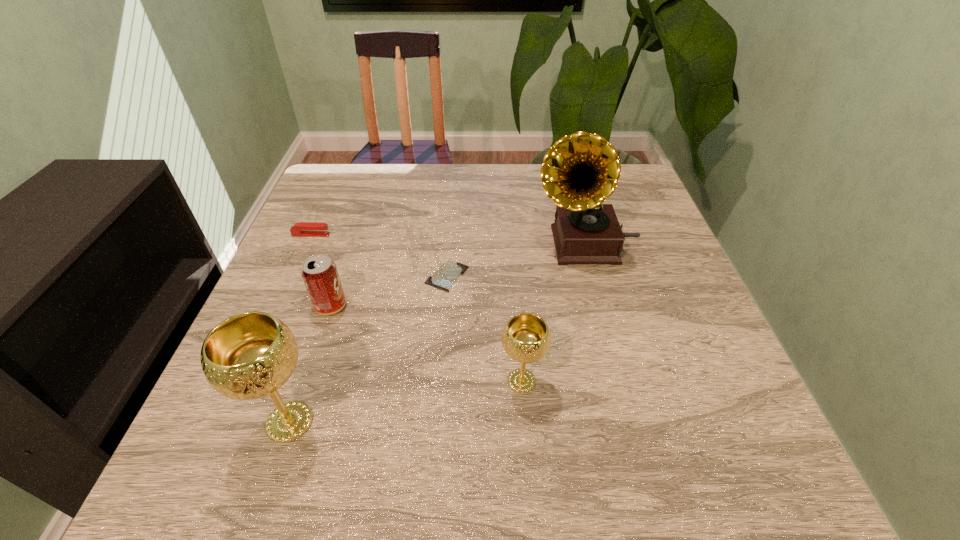
Identify the location of free spot between the shortest object and the fifth object from left to right. (484, 329).

Where is `vacant region between the right chalice and the second shortest object`? This screenshot has height=540, width=960. vacant region between the right chalice and the second shortest object is located at coordinates (417, 308).

At what (x,y) coordinates should I click in order to perform the action: click on vacant space that's between the identity card and the stapler. Please return your answer as a coordinate pair (x, y). This screenshot has width=960, height=540. Looking at the image, I should click on (379, 255).

This screenshot has width=960, height=540. Identify the location of free space that is in between the second shortest object and the taller chalice. (300, 328).

This screenshot has height=540, width=960. What are the coordinates of `vacant area that lies between the shortest object and the left chalice` in the screenshot? It's located at (369, 349).

This screenshot has height=540, width=960. Find the location of `free space between the soda can and the identity card`. free space between the soda can and the identity card is located at coordinates (389, 291).

What are the coordinates of `unoccupied position between the third nearest object and the fifth shortest object` in the screenshot? It's located at (310, 364).

Find the location of a particular element. Image resolution: width=960 pixels, height=540 pixels. empty space between the soda can and the fourth object from left to right is located at coordinates (389, 291).

Point out which object is positioned as the third nearest to the identity card. Please provide its 2D coordinates. Your answer should be formatted as a tuple, i.e. [(x, y)], where the tuple contains the x and y coordinates of a point satisfying the conditions above.

[(526, 338)]

Image resolution: width=960 pixels, height=540 pixels. What are the coordinates of `object that stands as the closest to the soda can` in the screenshot? It's located at (446, 275).